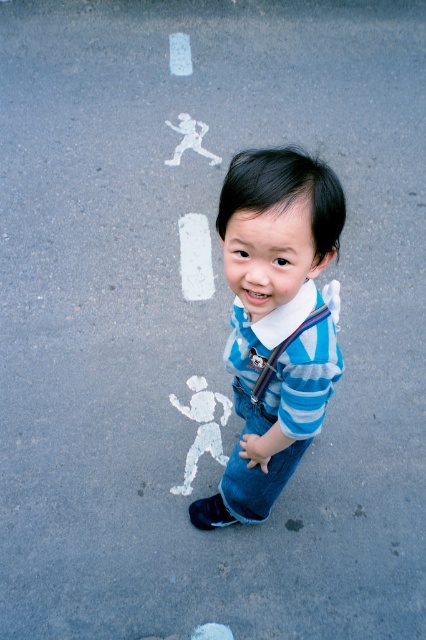
Question: Does blue striped shirt at center appear under striped fabric suspenders at center?

Choices:
 (A) no
 (B) yes

Answer: (B)

Question: In this image, where is blue striped shirt at center located relative to striped fabric suspenders at center?

Choices:
 (A) below
 (B) above

Answer: (A)

Question: Which object appears closest to the camera in this image?

Choices:
 (A) blue striped shirt at center
 (B) striped fabric suspenders at center

Answer: (A)

Question: Which object appears closest to the camera in this image?

Choices:
 (A) striped fabric suspenders at center
 (B) blue striped shirt at center

Answer: (B)

Question: Does blue striped shirt at center appear over striped fabric suspenders at center?

Choices:
 (A) no
 (B) yes

Answer: (A)